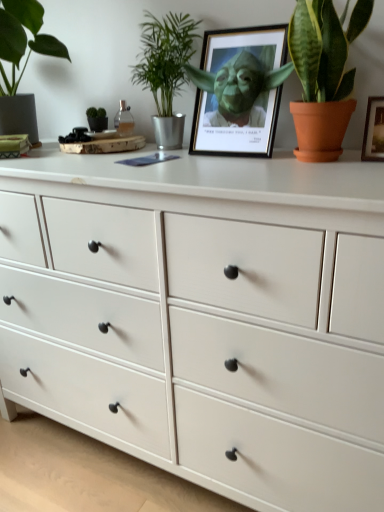
Question: From a real-world perspective, is white wood chest of drawers at center on matte black picture frame at center?

Choices:
 (A) yes
 (B) no

Answer: (B)

Question: Is white wood chest of drawers at center at the left side of matte black picture frame at center?

Choices:
 (A) yes
 (B) no

Answer: (A)

Question: Can you confirm if white wood chest of drawers at center is smaller than matte black picture frame at center?

Choices:
 (A) yes
 (B) no

Answer: (B)

Question: Does white wood chest of drawers at center come in front of matte black picture frame at center?

Choices:
 (A) yes
 (B) no

Answer: (A)

Question: From the image's perspective, is white wood chest of drawers at center above matte black picture frame at center?

Choices:
 (A) yes
 (B) no

Answer: (B)

Question: From the image's perspective, is green glossy leafy plant at upper right, the 1th houseplant from the right, located above or below matte black picture frame at center?

Choices:
 (A) above
 (B) below

Answer: (B)

Question: Does point (334, 64) appear closer or farther from the camera than point (240, 111)?

Choices:
 (A) farther
 (B) closer

Answer: (B)

Question: From a real-world perspective, relative to matte black picture frame at center, is green glossy leafy plant at upper right, the 3th houseplant positioned from the left, vertically above or below?

Choices:
 (A) below
 (B) above

Answer: (B)

Question: In the image, is green glossy leafy plant at upper right, the 3th houseplant positioned from the left, on the left side or the right side of matte black picture frame at center?

Choices:
 (A) left
 (B) right

Answer: (B)

Question: Considering the positions of point (271, 125) and point (200, 223), is point (271, 125) closer or farther from the camera than point (200, 223)?

Choices:
 (A) farther
 (B) closer

Answer: (A)

Question: From a real-world perspective, relative to white wood chest of drawers at center, is matte black picture frame at center vertically above or below?

Choices:
 (A) below
 (B) above

Answer: (B)

Question: Is matte black picture frame at center taller or shorter than white wood chest of drawers at center?

Choices:
 (A) short
 (B) tall

Answer: (A)

Question: Considering the positions of matte black picture frame at center and white wood chest of drawers at center in the image, is matte black picture frame at center wider or thinner than white wood chest of drawers at center?

Choices:
 (A) wide
 (B) thin

Answer: (B)

Question: In the image, is green leafy plant at upper center, marked as the 2th houseplant in a right-to-left arrangement, positioned in front of or behind matte black picture frame at center?

Choices:
 (A) behind
 (B) front

Answer: (A)

Question: In terms of size, does green leafy plant at upper center, marked as the 2th houseplant in a right-to-left arrangement, appear bigger or smaller than matte black picture frame at center?

Choices:
 (A) big
 (B) small

Answer: (B)